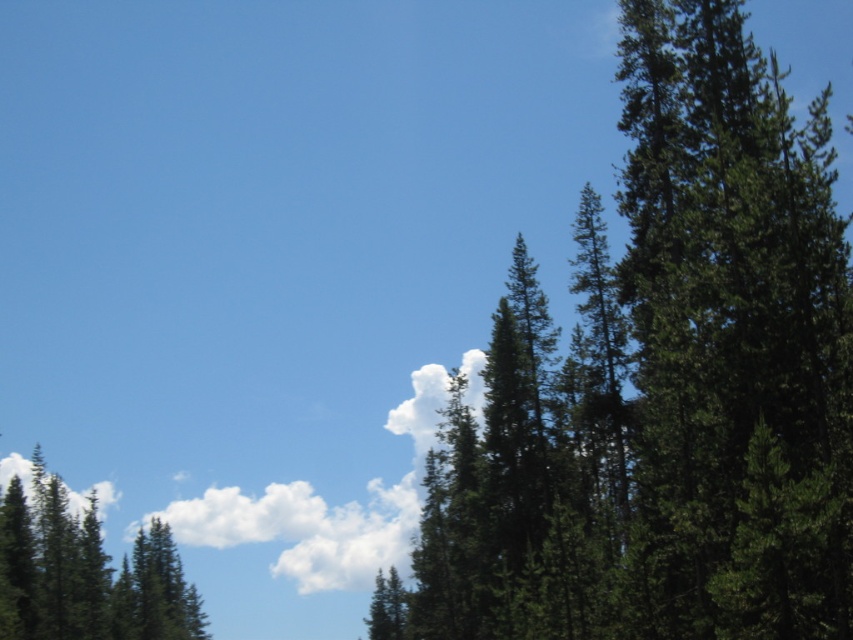
From the picture: You are an environmental scientist analyzing the image. You need to determine the spatial relationship between the green textured pine trees at upper right and the green matte tree at lower left. Which object is located above the other?

The green textured pine trees at upper right are positioned over the green matte tree at lower left, meaning they are above it in the image.

You are standing in the middle of the forest scene and want to walk towards the two points marked in the image. Which point, point (531, 275) or point (62, 595), will you reach first?

You will reach point (531, 275) first because it is closer to the camera than point (62, 595).

You are standing in a forest and want to take a photo of the green textured pine trees at upper right. If your camera can focus on objects up to 20 meters away, will you be able to capture a clear photo of them?

The green textured pine trees at upper right are 18.77 meters away from the viewer. Since the camera can focus up to 20 meters, you can capture a clear photo of them.